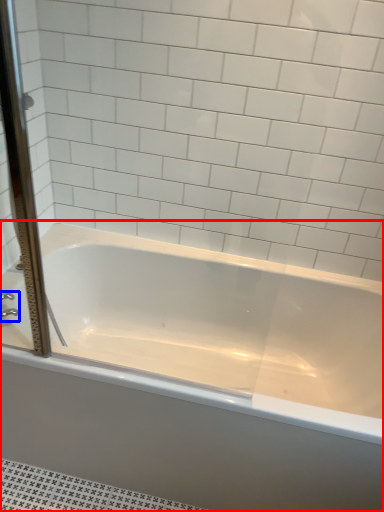
Question: Which point is closer to the camera, bathtub (highlighted by a red box) or faucet (highlighted by a blue box)?

Choices:
 (A) bathtub
 (B) faucet

Answer: (A)